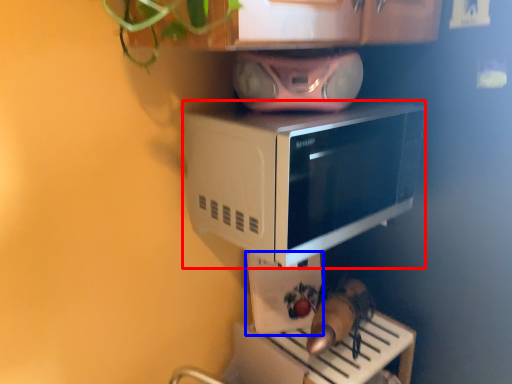
Question: Which of the following is the farthest to the observer, microwave oven (highlighted by a red box) or appliance (highlighted by a blue box)?

Choices:
 (A) microwave oven
 (B) appliance

Answer: (B)